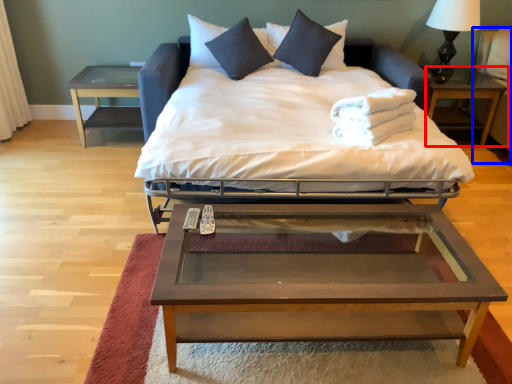
Question: Which object appears closest to the camera in this image, nightstand (highlighted by a red box) or armchair (highlighted by a blue box)?

Choices:
 (A) nightstand
 (B) armchair

Answer: (B)